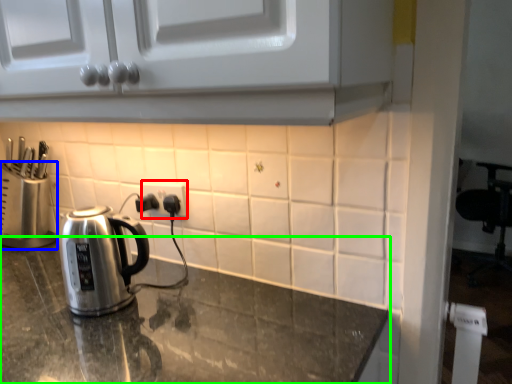
Question: Which is nearer to the electric outlet (highlighted by a red box)? appliance (highlighted by a blue box) or countertop (highlighted by a green box).

Choices:
 (A) appliance
 (B) countertop

Answer: (B)